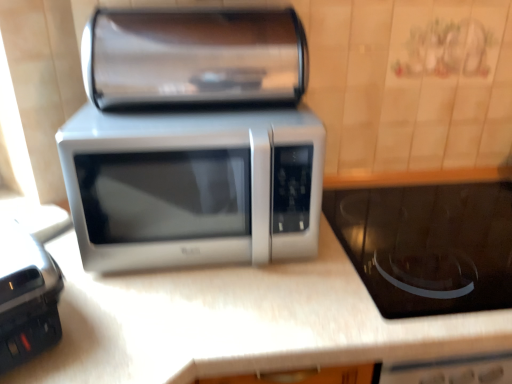
The height and width of the screenshot is (384, 512). Identify the location of vacant point to the right of satin silver microwave at center. (388, 244).